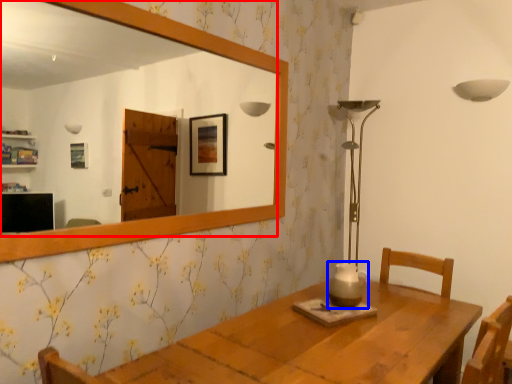
Question: Among these objects, which one is farthest to the camera, mirror (highlighted by a red box) or candle holder (highlighted by a blue box)?

Choices:
 (A) mirror
 (B) candle holder

Answer: (B)